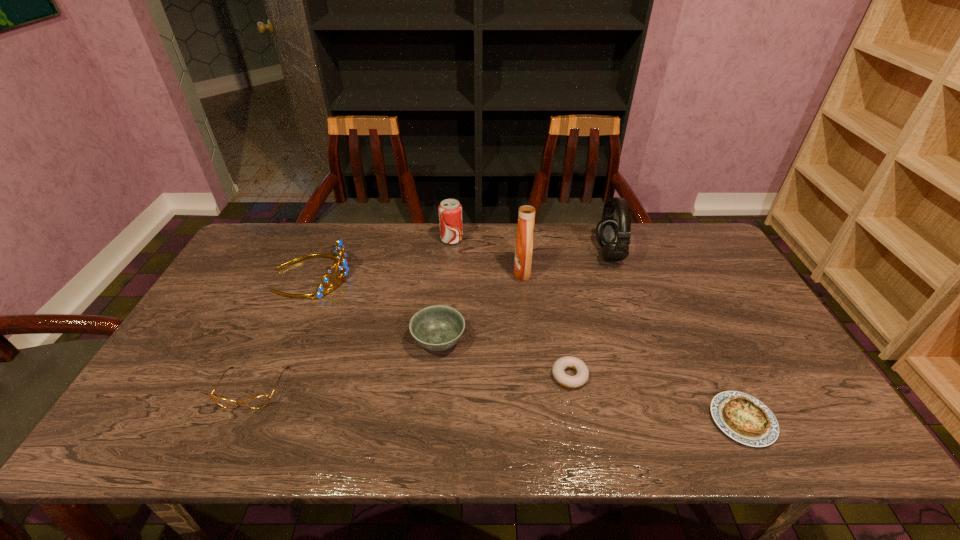
At what (x,y) coordinates should I click in order to perform the action: click on vacant region at the far edge of the desktop. Please return your answer as a coordinate pair (x, y). Looking at the image, I should click on (361, 260).

I want to click on vacant space at the near edge, so click(x=295, y=424).

The height and width of the screenshot is (540, 960). In order to click on free space at the left edge of the desktop in this screenshot , I will do pos(228,348).

In the image, there is a desktop. Where is `vacant region at the far left corner`? This screenshot has width=960, height=540. vacant region at the far left corner is located at coordinates (240, 262).

You are a GUI agent. You are given a task and a screenshot of the screen. Output one action in this format:
    pyautogui.click(x=<x>, y=<y>)
    Task: Click on the free space at the far right corner
    
    Given the screenshot: What is the action you would take?
    pyautogui.click(x=704, y=253)

You are a GUI agent. You are given a task and a screenshot of the screen. Output one action in this format:
    pyautogui.click(x=<x>, y=<y>)
    Task: Click on the free region at the near right corner of the desktop
    The width and height of the screenshot is (960, 540).
    Given the screenshot: What is the action you would take?
    pyautogui.click(x=816, y=423)

Where is `vacant point located between the doughnut and the rightmost object`? This screenshot has height=540, width=960. vacant point located between the doughnut and the rightmost object is located at coordinates click(656, 398).

Image resolution: width=960 pixels, height=540 pixels. I want to click on free point between the spectacles and the bowl, so click(x=346, y=364).

You are a GUI agent. You are given a task and a screenshot of the screen. Output one action in this format:
    pyautogui.click(x=<x>, y=<y>)
    Task: Click on the unoccupied position between the soda can and the quiche
    The image size is (960, 540).
    Given the screenshot: What is the action you would take?
    pyautogui.click(x=597, y=330)

I want to click on free point between the third object from right to left and the quiche, so click(656, 398).